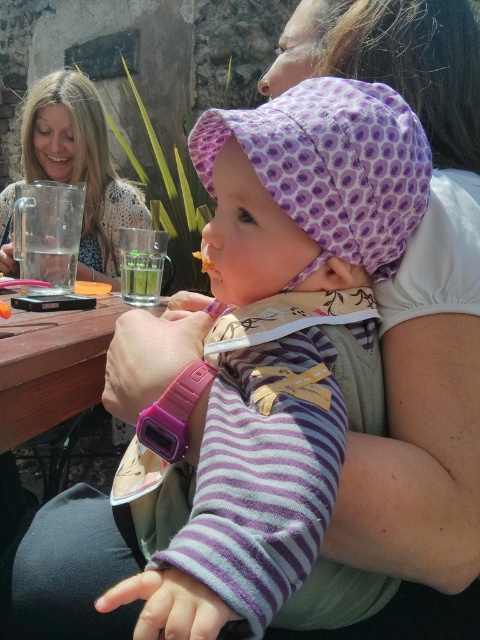
Does brown wooden picnic table at lower left have a smaller size compared to green leafy vegetable at center?

Incorrect, brown wooden picnic table at lower left is not smaller in size than green leafy vegetable at center.

Locate an element on the screen. brown wooden picnic table at lower left is located at coordinates (51, 365).

Which is above, blonde hair at upper left or green leafy vegetable at center?

blonde hair at upper left is higher up.

Looking at this image, does blonde hair at upper left have a lesser height compared to green leafy vegetable at center?

In fact, blonde hair at upper left may be taller than green leafy vegetable at center.

Describe the element at coordinates (81, 166) in the screenshot. I see `blonde hair at upper left` at that location.

I want to click on blonde hair at upper left, so click(x=81, y=166).

Is brown wooden picnic table at lower left below yellow crumbly food at center?

Indeed, brown wooden picnic table at lower left is positioned under yellow crumbly food at center.

Does brown wooden picnic table at lower left lie behind yellow crumbly food at center?

No, brown wooden picnic table at lower left is closer to the viewer.

What are the coordinates of `brown wooden picnic table at lower left` in the screenshot? It's located at (51, 365).

Identify the location of brown wooden picnic table at lower left. (x=51, y=365).